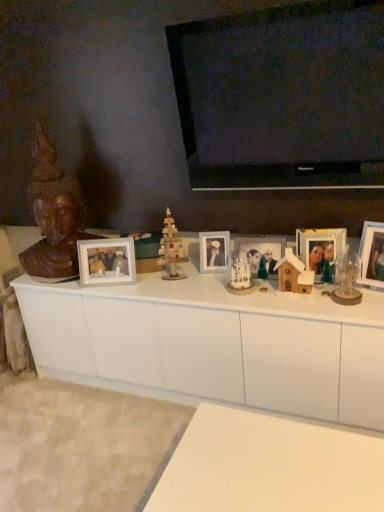
Locate an element on the screen. The image size is (384, 512). vacant space situated above white matte table at lower center (from a real-world perspective) is located at coordinates (267, 464).